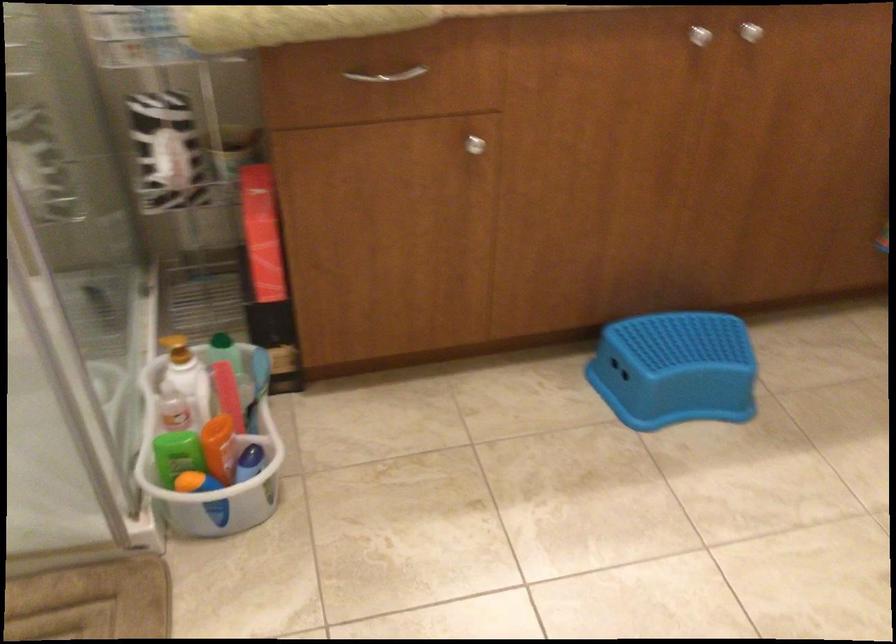
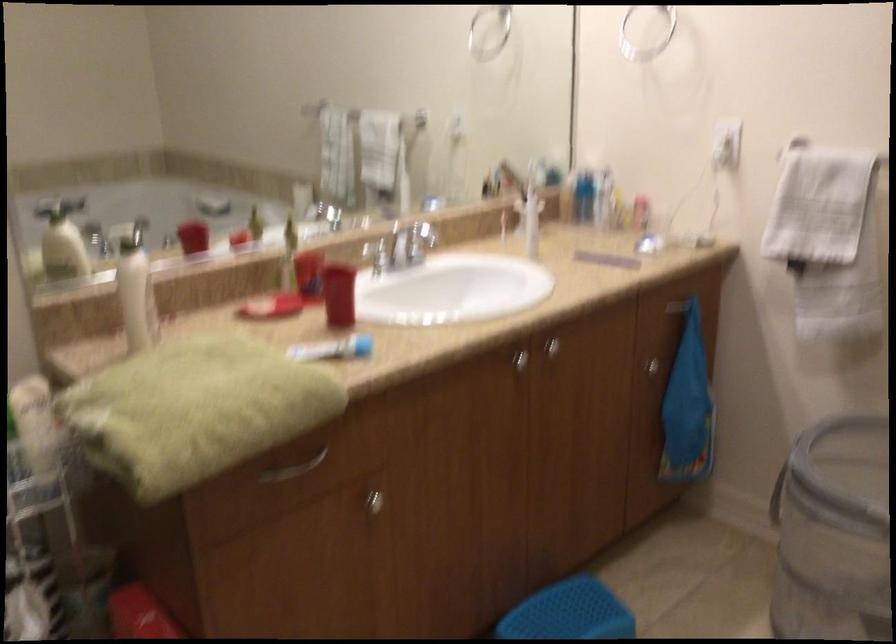
Where in the second image is the point corresponding to point 679,343 from the first image?

(569, 612)